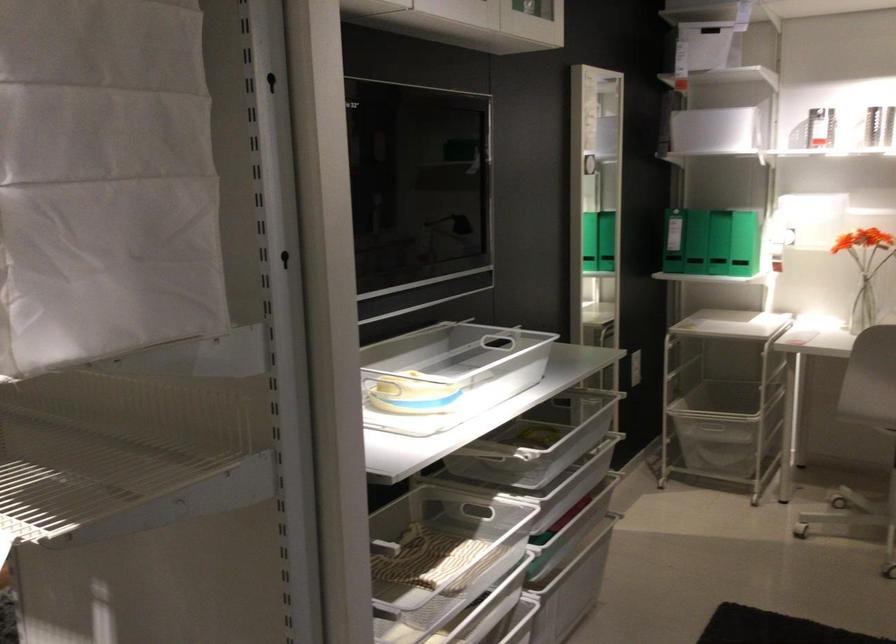
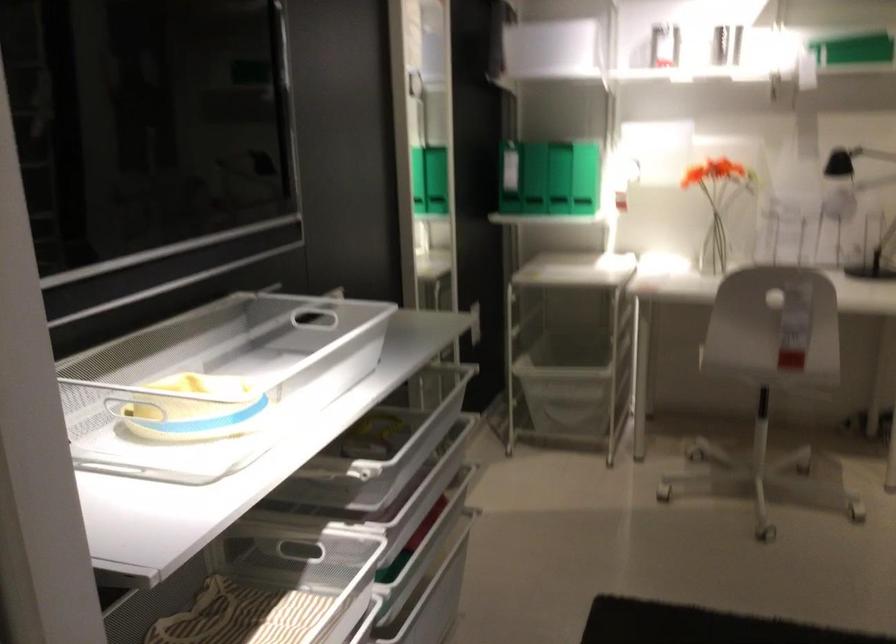
In the second image, find the point that corresponds to pixel 735 236 in the first image.

(558, 178)